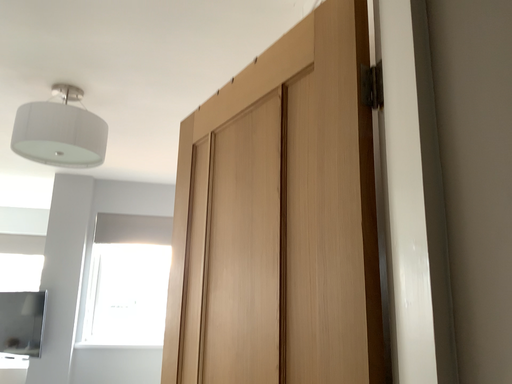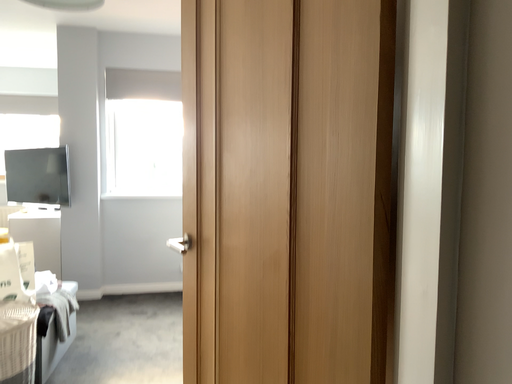
Question: Which way did the camera rotate in the video?

Choices:
 (A) rotated upward
 (B) rotated downward

Answer: (B)